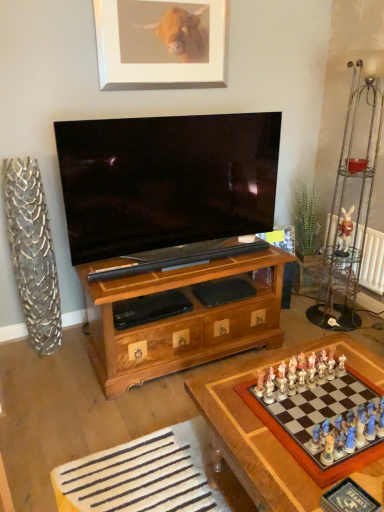
Question: Choose the correct answer: Is white ceramic rabbit at upper right inside white radiator at right or outside it?

Choices:
 (A) outside
 (B) inside

Answer: (A)

Question: Considering the positions of white ceramic rabbit at upper right and white radiator at right in the image, is white ceramic rabbit at upper right wider or thinner than white radiator at right?

Choices:
 (A) thin
 (B) wide

Answer: (B)

Question: Estimate the real-world distances between objects in this image. Which object is closer to the silver metallic picture frame at upper center?

Choices:
 (A) white radiator at right
 (B) white ceramic rabbit at upper right
 (C) wooden chessboard at lower right

Answer: (B)

Question: Which is farther from the wooden chessboard at lower right?

Choices:
 (A) white radiator at right
 (B) silver metallic picture frame at upper center
 (C) white ceramic rabbit at upper right

Answer: (B)